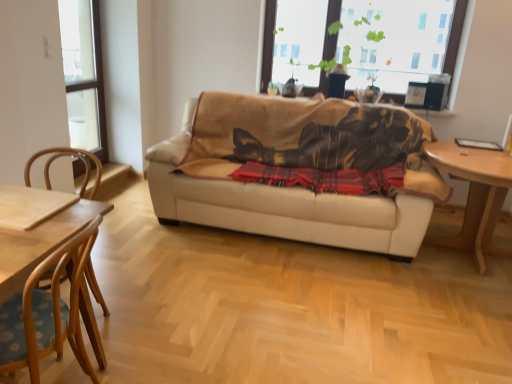
Question: Is wooden chair at left, the 1th chair positioned from the front, inside or outside of light brown wooden table at right?

Choices:
 (A) outside
 (B) inside

Answer: (A)

Question: From the image's perspective, is wooden chair at left, which is counted as the second chair, starting from the back, positioned above or below light brown wooden table at right?

Choices:
 (A) above
 (B) below

Answer: (B)

Question: Which of these objects is positioned farthest from the beige leather couch at center?

Choices:
 (A) transparent glass window at upper left, the second window viewed from the right
 (B) wooden chair at left, the 1th chair positioned from the front
 (C) red plaid blanket at center
 (D) transparent glass window at upper center, arranged as the first window when viewed from the right
 (E) light wood chair at left, the 2th chair in the front-to-back sequence

Answer: (A)

Question: Considering the real-world distances, which object is closest to the light brown wooden table at right?

Choices:
 (A) red plaid blanket at center
 (B) light wood chair at left, the 2th chair in the front-to-back sequence
 (C) wooden chair at left, which is counted as the second chair, starting from the back
 (D) transparent glass window at upper left, the second window viewed from the right
 (E) beige leather couch at center

Answer: (A)